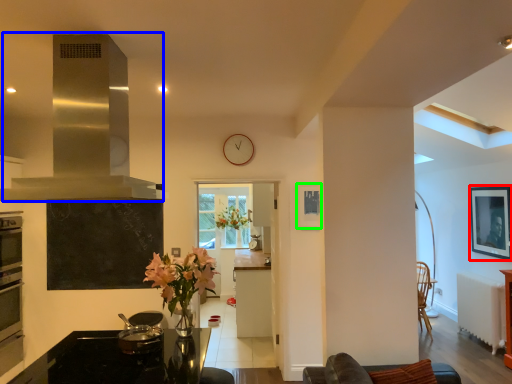
Question: Estimate the real-world distances between objects in this image. Which object is closer to picture frame (highlighted by a red box), exhaust hood (highlighted by a blue box) or picture frame (highlighted by a green box)?

Choices:
 (A) exhaust hood
 (B) picture frame

Answer: (B)